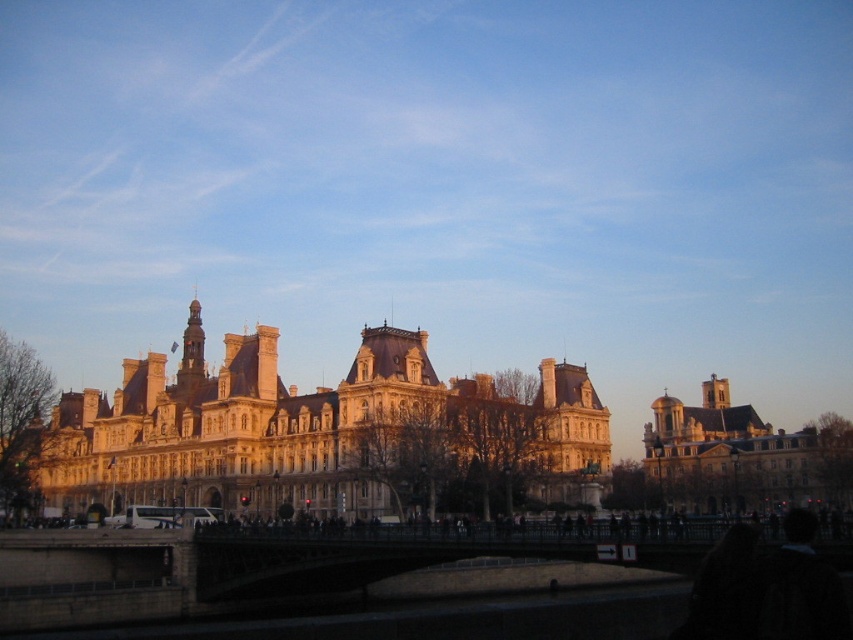
At what (x,y) coordinates should I click in order to perform the action: click on golden stone palace at center. Please return your answer as a coordinate pair (x, y). This screenshot has width=853, height=640. Looking at the image, I should click on coord(311,429).

Who is shorter, golden stone palace at center or golden stone church at right?

With less height is golden stone church at right.

The height and width of the screenshot is (640, 853). Find the location of `golden stone palace at center`. golden stone palace at center is located at coordinates (311, 429).